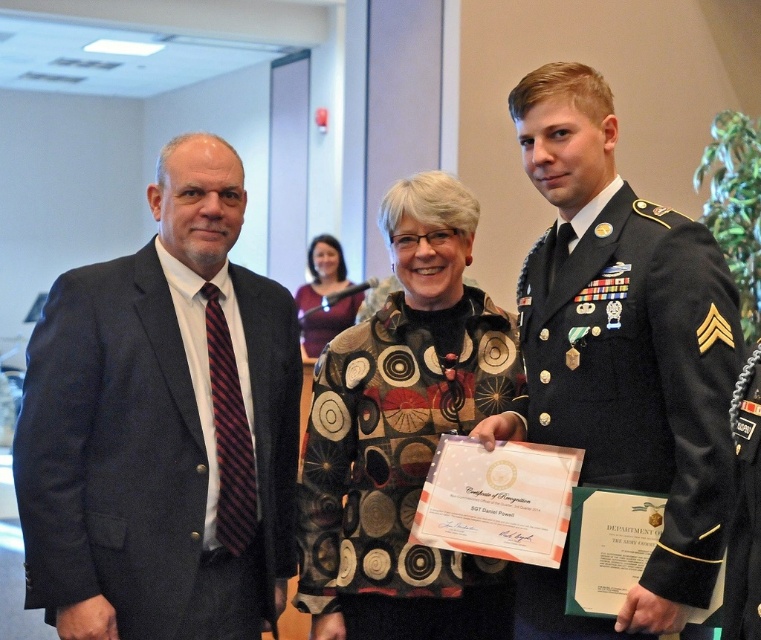
Is green military uniform at right positioned behind matte purple sweater at center?

No, green military uniform at right is closer to the viewer.

Who is positioned more to the right, green military uniform at right or matte purple sweater at center?

From the viewer's perspective, green military uniform at right appears more on the right side.

Between point (661, 483) and point (311, 320), which one is positioned in front?

Point (661, 483) is in front.

Find the location of a particular element. Image resolution: width=761 pixels, height=640 pixels. green military uniform at right is located at coordinates (639, 372).

Does point (40, 572) lie behind point (307, 301)?

No, it is not.

Does dark gray suit at left have a greater height compared to matte purple sweater at center?

Correct, dark gray suit at left is much taller as matte purple sweater at center.

Is point (271, 589) behind point (311, 346)?

No, it is not.

Find the location of a particular element. The width and height of the screenshot is (761, 640). dark gray suit at left is located at coordinates (161, 426).

Is point (481, 304) positioned before point (336, 317)?

Yes, it is.

This screenshot has width=761, height=640. What do you see at coordinates (400, 470) in the screenshot?
I see `green military uniform at center` at bounding box center [400, 470].

Locate an element on the screen. The image size is (761, 640). green military uniform at center is located at coordinates coord(400,470).

Where is `green military uniform at center`? The image size is (761, 640). green military uniform at center is located at coordinates (x=400, y=470).